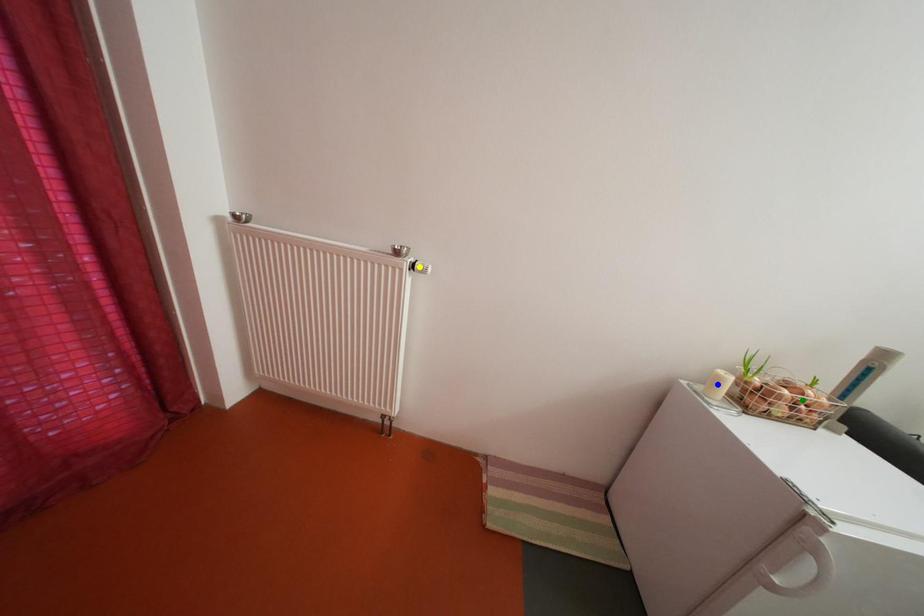
Order these from nearest to farthest:
1. yellow point
2. green point
3. blue point

green point, blue point, yellow point